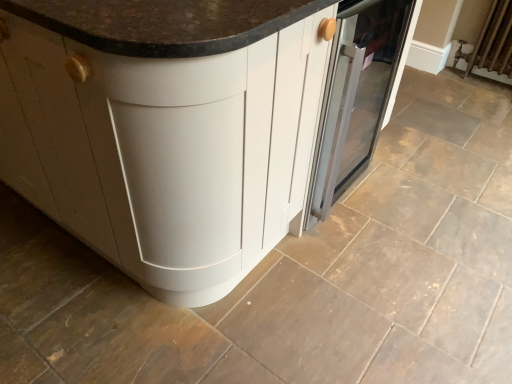
Question: Is point (508, 6) positioned closer to the camera than point (351, 56)?

Choices:
 (A) closer
 (B) farther

Answer: (B)

Question: Is brown fabric radiator at upper right bigger or smaller than satin silver oven at center?

Choices:
 (A) small
 (B) big

Answer: (A)

Question: Which object is positioned closest to the white matte cabinet at center?

Choices:
 (A) brown fabric radiator at upper right
 (B) satin silver oven at center

Answer: (B)

Question: Estimate the real-world distances between objects in this image. Which object is closer to the brown fabric radiator at upper right?

Choices:
 (A) white matte cabinet at center
 (B) satin silver oven at center

Answer: (B)